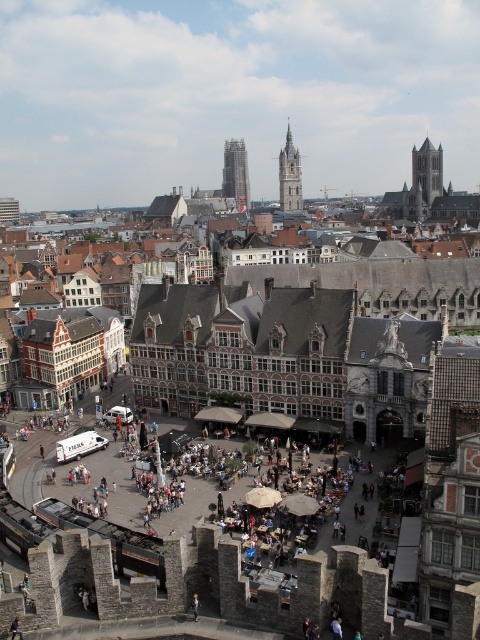
Can you confirm if gray stone tower at upper right is wider than gray stone clock tower at center?

Yes.

Is gray stone tower at upper right positioned in front of gray stone clock tower at center?

Yes.

Identify the location of gray stone tower at upper right. The image size is (480, 640). (428, 170).

Who is positioned more to the left, glassy steel skyscraper at center or gray stone tower at upper right?

Positioned to the left is glassy steel skyscraper at center.

Measure the distance between glassy steel skyscraper at center and gray stone tower at upper right.

glassy steel skyscraper at center and gray stone tower at upper right are 119.09 meters apart from each other.

Which is in front, point (241, 195) or point (430, 192)?

Point (430, 192)

Identify the location of glassy steel skyscraper at center. (x=236, y=173).

Based on the photo, does glassy steel skyscraper at center have a lesser width compared to gray stone clock tower at center?

No, glassy steel skyscraper at center is not thinner than gray stone clock tower at center.

In the scene shown: Between glassy steel skyscraper at center and gray stone clock tower at center, which one appears on the left side from the viewer's perspective?

glassy steel skyscraper at center is more to the left.

Who is more distant from viewer, (237, 156) or (295, 195)?

The point (237, 156) is more distant.

Locate an element on the screen. glassy steel skyscraper at center is located at coordinates (236, 173).